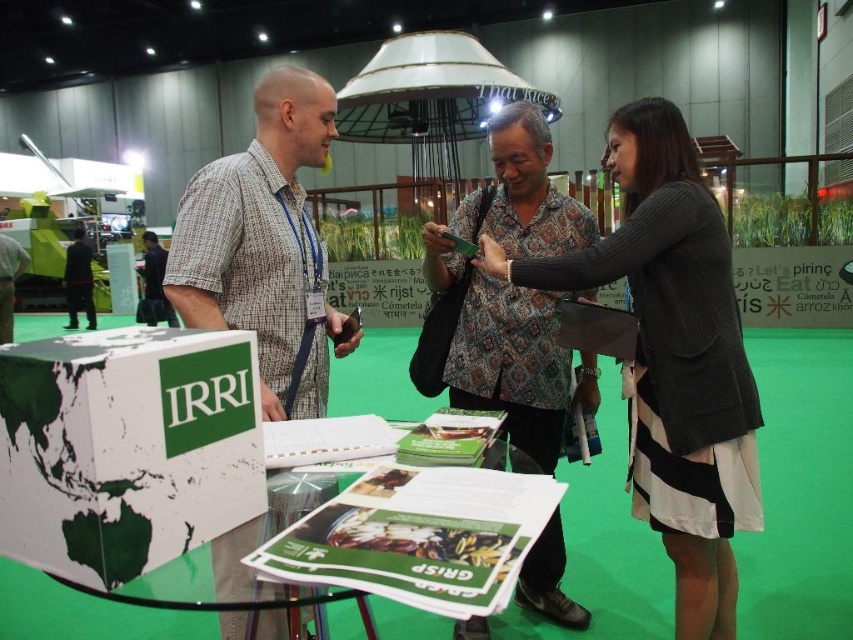
Question: Which object is closer to the camera taking this photo?

Choices:
 (A) black textured sweater at center
 (B) white paperboard box at center

Answer: (B)

Question: Among these points, which one is nearest to the camera?

Choices:
 (A) (759, 413)
 (B) (146, 316)

Answer: (A)

Question: Can you confirm if plaid shirt at center is smaller than black fabric jacket at left?

Choices:
 (A) no
 (B) yes

Answer: (B)

Question: Is matte black laptop at left further to camera compared to matte black shirt at center?

Choices:
 (A) no
 (B) yes

Answer: (A)

Question: Is white paperboard box at center positioned at the back of matte black shirt at center?

Choices:
 (A) no
 (B) yes

Answer: (A)

Question: Which of the following is the closest to the observer?

Choices:
 (A) (525, 564)
 (B) (131, 342)
 (C) (143, 250)
 (D) (224, 243)

Answer: (B)